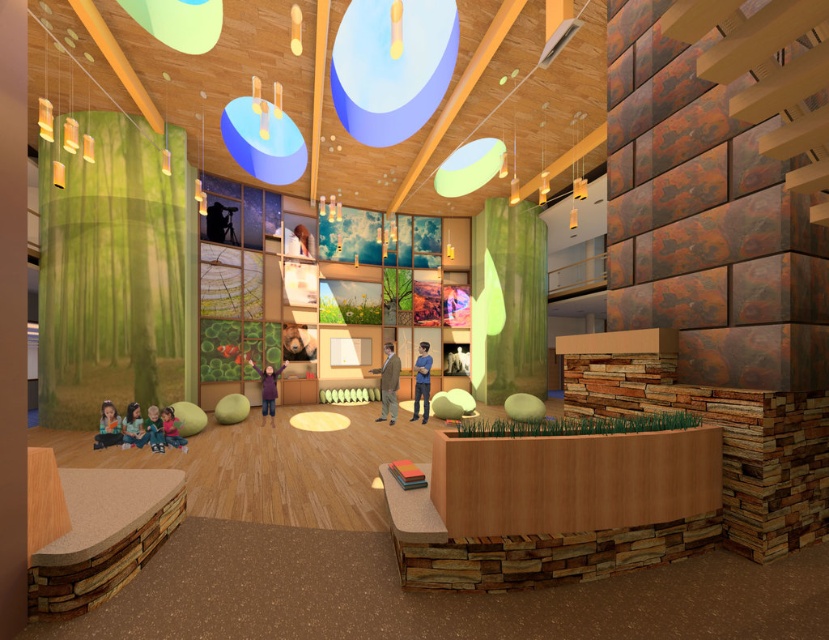
Is green matte curtain at left behind green glass leaf at center?

No, it is in front of green glass leaf at center.

This screenshot has width=829, height=640. What do you see at coordinates (110, 273) in the screenshot?
I see `green matte curtain at left` at bounding box center [110, 273].

What do you see at coordinates (110, 273) in the screenshot?
I see `green matte curtain at left` at bounding box center [110, 273].

The width and height of the screenshot is (829, 640). Identify the location of green matte curtain at left. (110, 273).